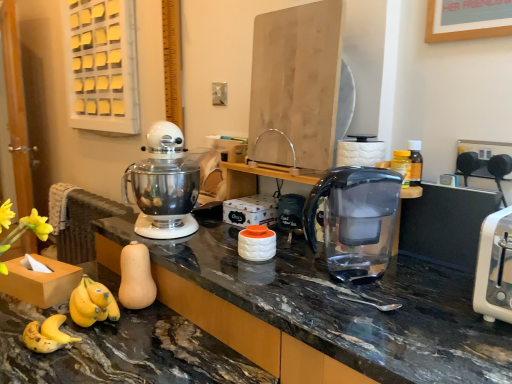
Locate an element on the screen. The height and width of the screenshot is (384, 512). vacant point to the left of white plastic toaster at right is located at coordinates (426, 312).